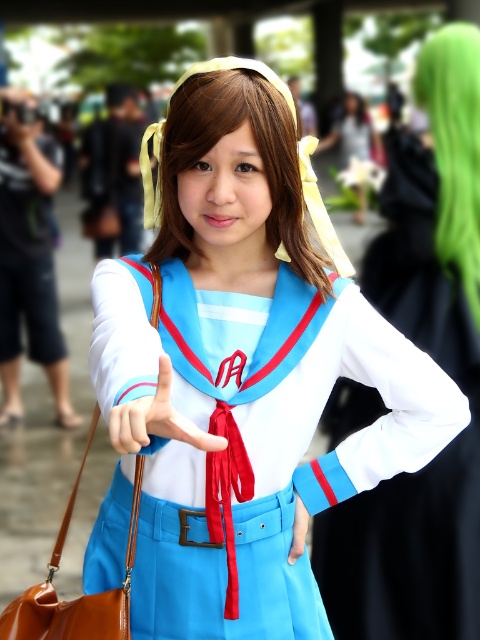
Can you confirm if white matte dress at center is taller than yellow fabric wig at center?

Indeed, white matte dress at center has a greater height compared to yellow fabric wig at center.

Which is more to the left, white matte dress at center or yellow fabric wig at center?

Positioned to the left is yellow fabric wig at center.

Is point (455, 344) less distant than point (192, 81)?

No.

The image size is (480, 640). I want to click on white matte dress at center, so click(x=428, y=464).

Is matte white hand at center positioned at the back of matte blue glove at center?

No.

Is the position of matte white hand at center less distant than that of matte blue glove at center?

Yes, matte white hand at center is in front of matte blue glove at center.

Where is `matte white hand at center`? This screenshot has height=640, width=480. matte white hand at center is located at coordinates point(156,419).

Which is more to the right, white matte dress at center or green synthetic wig at upper right?

green synthetic wig at upper right

Does white matte dress at center appear over green synthetic wig at upper right?

No, white matte dress at center is not above green synthetic wig at upper right.

Which is behind, point (393, 156) or point (441, 241)?

Positioned behind is point (393, 156).

Locate an element on the screen. This screenshot has width=480, height=640. white matte dress at center is located at coordinates (428, 464).